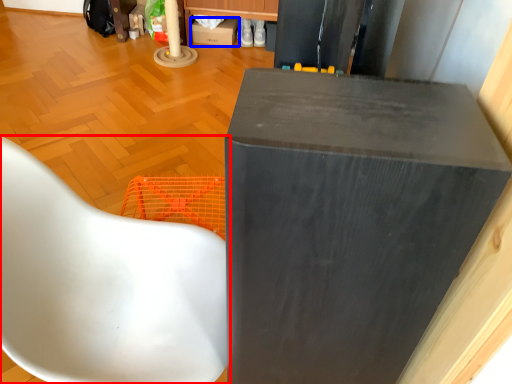
Question: Which object appears farthest to the camera in this image, chair (highlighted by a red box) or cardboard box (highlighted by a blue box)?

Choices:
 (A) chair
 (B) cardboard box

Answer: (B)